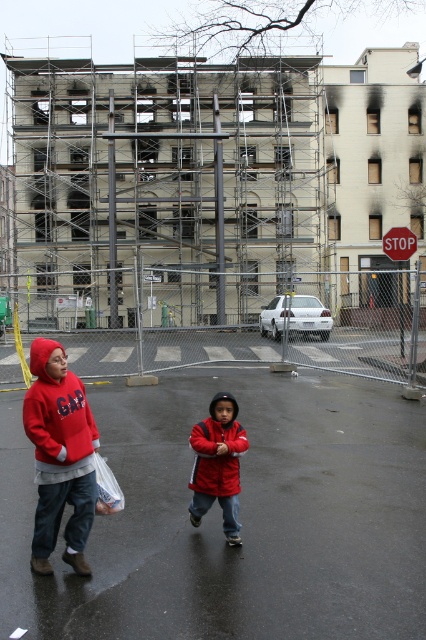
Question: Which object is positioned closest to the red matte jacket at center?

Choices:
 (A) white plastic bag at lower left
 (B) red plastic stop sign at center
 (C) matte red hoodie at center
 (D) metal scaffolding at upper center

Answer: (A)

Question: Which point is closer to the camera?

Choices:
 (A) white plastic bag at lower left
 (B) matte red hoodie at center

Answer: (B)

Question: Is metal scaffolding at upper center thinner than red matte jacket at center?

Choices:
 (A) no
 (B) yes

Answer: (A)

Question: Which of the following is the farthest from the observer?

Choices:
 (A) (210, 404)
 (B) (77, 80)
 (C) (66, 372)
 (D) (416, 240)

Answer: (B)

Question: Is metal scaffolding at upper center positioned in front of matte red hoodie at center?

Choices:
 (A) no
 (B) yes

Answer: (A)

Question: Does white plastic bag at lower left have a larger size compared to red plastic stop sign at center?

Choices:
 (A) yes
 (B) no

Answer: (B)